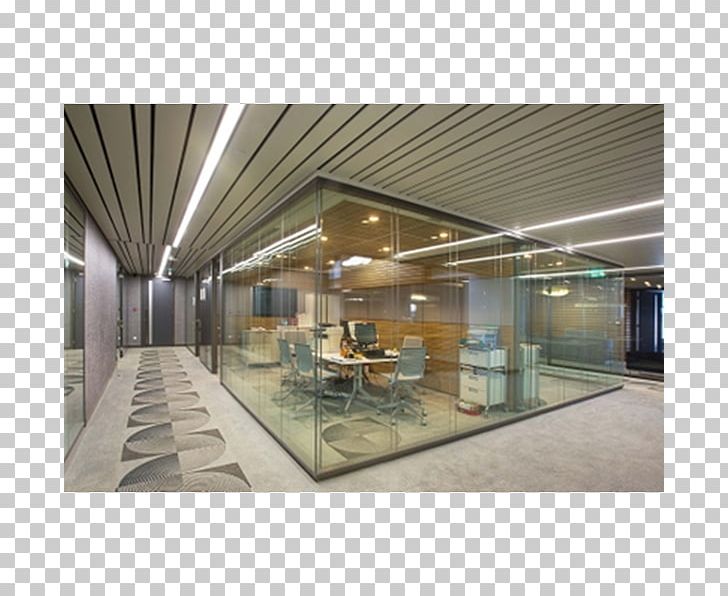
Identify the location of chairs. Image resolution: width=728 pixels, height=596 pixels. (414, 356), (360, 338), (341, 340).